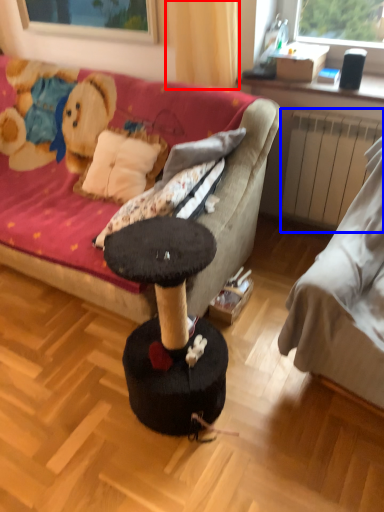
Question: Which of the following is the farthest to the observer, curtain (highlighted by a red box) or radiator (highlighted by a blue box)?

Choices:
 (A) curtain
 (B) radiator

Answer: (B)